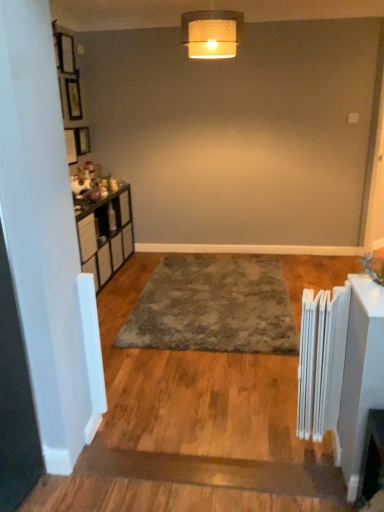
Question: Would you say wooden picture frame at upper left is outside woven fabric lampshade at upper center?

Choices:
 (A) no
 (B) yes

Answer: (B)

Question: Is wooden picture frame at upper left bigger than woven fabric lampshade at upper center?

Choices:
 (A) yes
 (B) no

Answer: (B)

Question: Does wooden picture frame at upper left have a smaller size compared to woven fabric lampshade at upper center?

Choices:
 (A) yes
 (B) no

Answer: (A)

Question: Does wooden picture frame at upper left have a lesser height compared to woven fabric lampshade at upper center?

Choices:
 (A) no
 (B) yes

Answer: (B)

Question: Can you confirm if wooden picture frame at upper left is positioned to the left of woven fabric lampshade at upper center?

Choices:
 (A) no
 (B) yes

Answer: (B)

Question: From a real-world perspective, is white metallic radiator at right above or below woven fabric lampshade at upper center?

Choices:
 (A) below
 (B) above

Answer: (A)

Question: Is white metallic radiator at right taller or shorter than woven fabric lampshade at upper center?

Choices:
 (A) short
 (B) tall

Answer: (B)

Question: Considering their positions, is white metallic radiator at right located in front of or behind woven fabric lampshade at upper center?

Choices:
 (A) front
 (B) behind

Answer: (A)

Question: Looking at their shapes, would you say white metallic radiator at right is wider or thinner than woven fabric lampshade at upper center?

Choices:
 (A) wide
 (B) thin

Answer: (B)

Question: Considering the relative positions of gray shaggy rug at center and wooden picture frame at upper left in the image provided, is gray shaggy rug at center to the left or to the right of wooden picture frame at upper left?

Choices:
 (A) left
 (B) right

Answer: (B)

Question: Would you say gray shaggy rug at center is inside or outside wooden picture frame at upper left?

Choices:
 (A) outside
 (B) inside

Answer: (A)

Question: From a real-world perspective, is gray shaggy rug at center above or below wooden picture frame at upper left?

Choices:
 (A) above
 (B) below

Answer: (B)

Question: Considering the positions of gray shaggy rug at center and wooden picture frame at upper left in the image, is gray shaggy rug at center bigger or smaller than wooden picture frame at upper left?

Choices:
 (A) small
 (B) big

Answer: (B)

Question: Is wooden picture frame at upper left to the left or to the right of white metallic radiator at right in the image?

Choices:
 (A) right
 (B) left

Answer: (B)

Question: Would you say wooden picture frame at upper left is inside or outside white metallic radiator at right?

Choices:
 (A) inside
 (B) outside

Answer: (B)